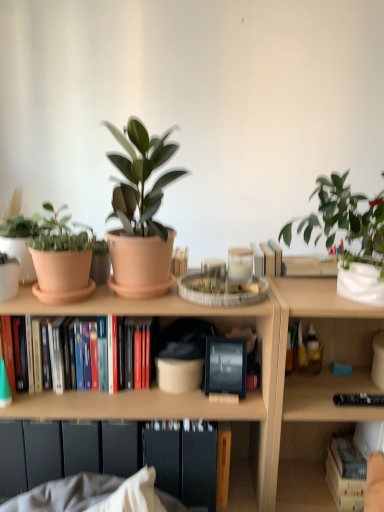
Image resolution: width=384 pixels, height=512 pixels. Describe the element at coordinates (346, 474) in the screenshot. I see `hardcover book at lower right, the 1th book in the right-to-left sequence` at that location.

Image resolution: width=384 pixels, height=512 pixels. What do you see at coordinates (62, 275) in the screenshot?
I see `terracotta clay pot at left, the 1th flowerpot in the left-to-right sequence` at bounding box center [62, 275].

The height and width of the screenshot is (512, 384). Describe the element at coordinates (67, 354) in the screenshot. I see `hardcover books at center left, acting as the 2th book starting from the right` at that location.

The image size is (384, 512). I want to click on wooden bookcase at center, so click(x=248, y=393).

What do you see at coordinates (189, 465) in the screenshot? I see `matte black cabinet at lower center` at bounding box center [189, 465].

This screenshot has width=384, height=512. Identify the location of matte terracotta pot at center, which appears as the first houseplant when viewed from the front. click(x=140, y=214).

Between hardcover book at lower right, positioned as the second book in left-to-right order, and matte terracotta pot at center, which appears as the first houseplant when viewed from the front, which one has smaller size?

hardcover book at lower right, positioned as the second book in left-to-right order.

Is hardcover book at lower right, marked as the 1th book in a bottom-to-top arrangement, oriented towards matte terracotta pot at center, the first houseplant in the left-to-right sequence?

No, hardcover book at lower right, marked as the 1th book in a bottom-to-top arrangement, is not aimed at matte terracotta pot at center, the first houseplant in the left-to-right sequence.

Image resolution: width=384 pixels, height=512 pixels. Find the location of `the 2nd houseplant counting from the left of the hardcover book at lower right, placed as the second book when sorted from top to bottom`. the 2nd houseplant counting from the left of the hardcover book at lower right, placed as the second book when sorted from top to bottom is located at coordinates (140, 214).

Would you say hardcover book at lower right, marked as the 1th book in a bottom-to-top arrangement, is outside matte terracotta pot at center, placed as the second houseplant when sorted from right to left?

Yes, hardcover book at lower right, marked as the 1th book in a bottom-to-top arrangement, is not within matte terracotta pot at center, placed as the second houseplant when sorted from right to left.

Considering the relative sizes of matte black cabinet at lower center and wooden bookcase at center in the image provided, is matte black cabinet at lower center taller than wooden bookcase at center?

No.

From the image's perspective, between matte black cabinet at lower center and wooden bookcase at center, who is located below?

matte black cabinet at lower center appears lower in the image.

Are matte black cabinet at lower center and wooden bookcase at center located far from each other?

No, matte black cabinet at lower center is not far from wooden bookcase at center.

Between matte black cabinet at lower center and wooden bookcase at center, which one appears on the left side from the viewer's perspective?

Positioned to the left is matte black cabinet at lower center.

Based on the photo, which of these two, matte terracotta pot at center, which appears as the first houseplant when viewed from the front, or white glossy pot at upper right, which appears as the second houseplant when viewed from the front, stands taller?

Standing taller between the two is white glossy pot at upper right, which appears as the second houseplant when viewed from the front.

Considering the relative sizes of matte terracotta pot at center, which appears as the first houseplant when viewed from the front, and white glossy pot at upper right, the second houseplant in the left-to-right sequence, in the image provided, is matte terracotta pot at center, which appears as the first houseplant when viewed from the front, smaller than white glossy pot at upper right, the second houseplant in the left-to-right sequence,?

Yes.

Can you confirm if matte terracotta pot at center, which appears as the first houseplant when viewed from the front, is thinner than white glossy pot at upper right, the second houseplant in the left-to-right sequence?

Yes.

Considering the positions of objects matte terracotta pot at center, which appears as the first houseplant when viewed from the front, and white glossy pot at upper right, marked as the first houseplant in a right-to-left arrangement, in the image provided, who is more to the right, matte terracotta pot at center, which appears as the first houseplant when viewed from the front, or white glossy pot at upper right, marked as the first houseplant in a right-to-left arrangement,?

white glossy pot at upper right, marked as the first houseplant in a right-to-left arrangement.

Can you tell me how much wooden bookcase at center and hardcover books at center left, which is counted as the 1th book, starting from the top, differ in facing direction?

90.7 degrees separate the facing orientations of wooden bookcase at center and hardcover books at center left, which is counted as the 1th book, starting from the top.

Is wooden bookcase at center turned away from hardcover books at center left, acting as the 2th book starting from the right?

That's not correct — wooden bookcase at center is not looking away from hardcover books at center left, acting as the 2th book starting from the right.

Considering the sizes of wooden bookcase at center and hardcover books at center left, which is counted as the 2th book, starting from the bottom, in the image, is wooden bookcase at center taller or shorter than hardcover books at center left, which is counted as the 2th book, starting from the bottom,?

Clearly, wooden bookcase at center is taller compared to hardcover books at center left, which is counted as the 2th book, starting from the bottom.

From the image's perspective, relative to hardcover books at center left, acting as the 2th book starting from the right, is wooden bookcase at center above or below?

Clearly, from the image's perspective, wooden bookcase at center is below hardcover books at center left, acting as the 2th book starting from the right.

From the image's perspective, is matte terracotta pot at center, which appears as the second houseplant when viewed from the back, above or below terracotta clay pot at left, marked as the second flowerpot in a right-to-left arrangement?

Based on their image positions, matte terracotta pot at center, which appears as the second houseplant when viewed from the back, is located above terracotta clay pot at left, marked as the second flowerpot in a right-to-left arrangement.

Is matte terracotta pot at center, the first houseplant in the left-to-right sequence, touching terracotta clay pot at left, marked as the second flowerpot in a right-to-left arrangement?

No, matte terracotta pot at center, the first houseplant in the left-to-right sequence, is not touching terracotta clay pot at left, marked as the second flowerpot in a right-to-left arrangement.

Which of these two, matte terracotta pot at center, the first houseplant in the left-to-right sequence, or terracotta clay pot at left, marked as the second flowerpot in a right-to-left arrangement, is smaller?

Smaller between the two is terracotta clay pot at left, marked as the second flowerpot in a right-to-left arrangement.

Could you tell me if matte terracotta pot at center, the first houseplant in the left-to-right sequence, is facing terracotta clay pot at left, marked as the second flowerpot in a right-to-left arrangement?

No, matte terracotta pot at center, the first houseplant in the left-to-right sequence, is not facing towards terracotta clay pot at left, marked as the second flowerpot in a right-to-left arrangement.

Is wooden bookcase at center aimed at matte terracotta pot at center, which appears as the first houseplant when viewed from the front?

No, wooden bookcase at center does not turn towards matte terracotta pot at center, which appears as the first houseplant when viewed from the front.

Which is more to the left, wooden bookcase at center or matte terracotta pot at center, placed as the second houseplant when sorted from right to left?

matte terracotta pot at center, placed as the second houseplant when sorted from right to left.

Is wooden bookcase at center further to camera compared to matte terracotta pot at center, which appears as the second houseplant when viewed from the back?

Yes, it is.

Is point (144, 226) farther from viewer compared to point (362, 272)?

No, (144, 226) is closer to viewer.

Between matte terracotta pot at center, which appears as the first houseplant when viewed from the front, and white matte vase at upper right, the 1th flowerpot positioned from the right, which one has less height?

With less height is white matte vase at upper right, the 1th flowerpot positioned from the right.

Considering the relative sizes of matte terracotta pot at center, which appears as the first houseplant when viewed from the front, and white matte vase at upper right, the 2th flowerpot from the left, in the image provided, is matte terracotta pot at center, which appears as the first houseplant when viewed from the front, smaller than white matte vase at upper right, the 2th flowerpot from the left,?

Actually, matte terracotta pot at center, which appears as the first houseplant when viewed from the front, might be larger than white matte vase at upper right, the 2th flowerpot from the left.

Does matte terracotta pot at center, the first houseplant in the left-to-right sequence, appear on the right side of white matte vase at upper right, the 1th flowerpot positioned from the right?

No, matte terracotta pot at center, the first houseplant in the left-to-right sequence, is not to the right of white matte vase at upper right, the 1th flowerpot positioned from the right.

Identify the location of book that is the 2nd object located behind the matte terracotta pot at center, placed as the second houseplant when sorted from right to left. (346, 474).

Find the location of a particular element. The height and width of the screenshot is (512, 384). cabinet below the wooden bookcase at center (from the image's perspective) is located at coordinates (189, 465).

Estimate the real-world distances between objects in this image. Which object is closer to terracotta clay pot at left, marked as the second flowerpot in a right-to-left arrangement, white matte vase at upper right, the 2th flowerpot from the left, or hardcover book at lower right, placed as the second book when sorted from top to bottom?

white matte vase at upper right, the 2th flowerpot from the left, is positioned closer to the anchor terracotta clay pot at left, marked as the second flowerpot in a right-to-left arrangement.

From the image, which object appears to be nearer to matte black cabinet at lower center, terracotta clay pot at left, the 1th flowerpot in the left-to-right sequence, or hardcover books at center left, acting as the 2th book starting from the right?

hardcover books at center left, acting as the 2th book starting from the right.

Which object lies further to the anchor point terracotta clay pot at left, the 1th flowerpot in the left-to-right sequence, matte terracotta pot at center, which appears as the second houseplant when viewed from the back, or white matte vase at upper right, the 1th flowerpot positioned from the right?

The object further to terracotta clay pot at left, the 1th flowerpot in the left-to-right sequence, is white matte vase at upper right, the 1th flowerpot positioned from the right.

From the image, which object appears to be farther from white glossy pot at upper right, which appears as the second houseplant when viewed from the front, wooden bookcase at center or hardcover books at center left, which is counted as the 1th book, starting from the top?

hardcover books at center left, which is counted as the 1th book, starting from the top, lies further to white glossy pot at upper right, which appears as the second houseplant when viewed from the front, than the other object.

Estimate the real-world distances between objects in this image. Which object is further from terracotta clay pot at left, marked as the second flowerpot in a right-to-left arrangement, white glossy pot at upper right, which appears as the second houseplant when viewed from the front, or hardcover book at lower right, positioned as the second book in left-to-right order?

Among the two, hardcover book at lower right, positioned as the second book in left-to-right order, is located further to terracotta clay pot at left, marked as the second flowerpot in a right-to-left arrangement.

Estimate the real-world distances between objects in this image. Which object is further from white glossy pot at upper right, which appears as the second houseplant when viewed from the front, white matte vase at upper right, the 2th flowerpot from the left, or terracotta clay pot at left, the 1th flowerpot in the left-to-right sequence?

Among the two, terracotta clay pot at left, the 1th flowerpot in the left-to-right sequence, is located further to white glossy pot at upper right, which appears as the second houseplant when viewed from the front.

Considering their positions, is wooden bookcase at center positioned further to white matte vase at upper right, the 2th flowerpot from the left, than matte black cabinet at lower center?

matte black cabinet at lower center.

In the scene shown: Considering their positions, is terracotta clay pot at left, marked as the second flowerpot in a right-to-left arrangement, positioned closer to wooden bookcase at center than hardcover book at lower right, placed as the second book when sorted from top to bottom?

terracotta clay pot at left, marked as the second flowerpot in a right-to-left arrangement, lies closer to wooden bookcase at center than the other object.

Where is `book between terracotta clay pot at left, marked as the second flowerpot in a right-to-left arrangement, and white glossy pot at upper right, marked as the first houseplant in a right-to-left arrangement, in the horizontal direction`? This screenshot has height=512, width=384. book between terracotta clay pot at left, marked as the second flowerpot in a right-to-left arrangement, and white glossy pot at upper right, marked as the first houseplant in a right-to-left arrangement, in the horizontal direction is located at coordinates (67, 354).

This screenshot has height=512, width=384. I want to click on houseplant located between terracotta clay pot at left, marked as the second flowerpot in a right-to-left arrangement, and white matte vase at upper right, the 1th flowerpot positioned from the right, in the left-right direction, so click(x=140, y=214).

Where is `book between terracotta clay pot at left, marked as the second flowerpot in a right-to-left arrangement, and white matte vase at upper right, the 2th flowerpot from the left, from left to right`? This screenshot has width=384, height=512. book between terracotta clay pot at left, marked as the second flowerpot in a right-to-left arrangement, and white matte vase at upper right, the 2th flowerpot from the left, from left to right is located at coordinates (67, 354).

This screenshot has width=384, height=512. Identify the location of bookcase between matte black cabinet at lower center and hardcover books at center left, which is counted as the 1th book, starting from the top, in the front-back direction. (248, 393).